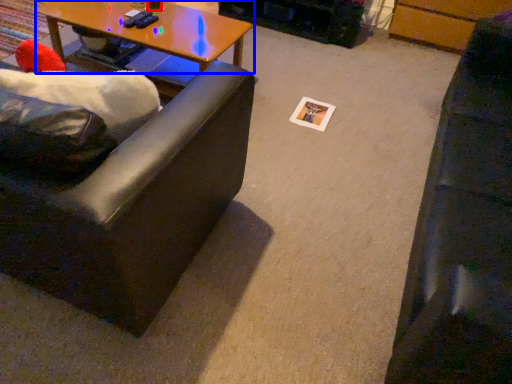
Question: Which object appears closest to the camera in this image, coffee cup (highlighted by a red box) or coffee table (highlighted by a blue box)?

Choices:
 (A) coffee cup
 (B) coffee table

Answer: (B)